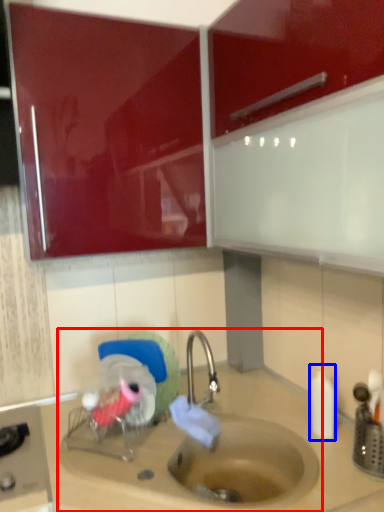
Question: Which of the following is the farthest to the observer, sink (highlighted by a red box) or bottle (highlighted by a blue box)?

Choices:
 (A) sink
 (B) bottle

Answer: (B)